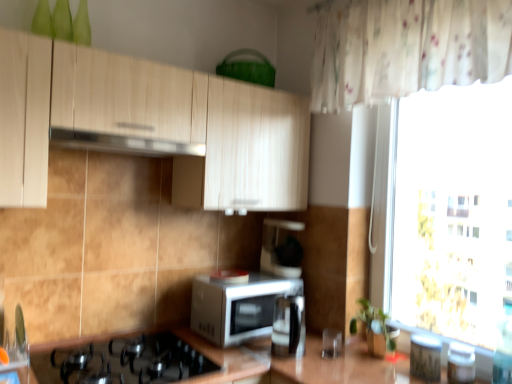
What do you see at coordinates (123, 361) in the screenshot?
I see `black matte gas stove at lower left` at bounding box center [123, 361].

The image size is (512, 384). What do you see at coordinates (451, 210) in the screenshot?
I see `white sheer curtain at right` at bounding box center [451, 210].

You are a GUI agent. You are given a task and a screenshot of the screen. Output one action in this format:
    pyautogui.click(x=<x>, y=<y>)
    Task: Click on the satin silver kettle at center, which is counted as the first appliance, starting from the left
    The height and width of the screenshot is (384, 512).
    Given the screenshot: What is the action you would take?
    pyautogui.click(x=288, y=327)

The width and height of the screenshot is (512, 384). What do you see at coordinates (460, 364) in the screenshot?
I see `metallic silver toaster at right, which is the 1th appliance in right-to-left order` at bounding box center [460, 364].

At what (x,y) coordinates should I click in order to perform the action: click on sleek black coffee machine at center. Please return your answer as a coordinate pair (x, y). This screenshot has height=384, width=512. Looking at the image, I should click on 281,248.

Locate an element on the screen. The height and width of the screenshot is (384, 512). satin silver exhaust hood at upper center is located at coordinates (123, 143).

Describe the element at coordinates (425, 358) in the screenshot. The height and width of the screenshot is (384, 512). I see `metallic silver toaster at lower right, which is the 2th appliance from right to left` at that location.

Locate an element on the screen. This screenshot has height=384, width=512. white glossy microwave at center is located at coordinates (237, 307).

Where is `black matte gas stove at lower left`? The image size is (512, 384). black matte gas stove at lower left is located at coordinates (123, 361).

Between point (448, 351) and point (257, 291), which one is positioned in front?

Positioned in front is point (448, 351).

From the image's perspective, does metallic silver toaster at right, which is counted as the 3th appliance, starting from the left, appear lower than white glossy microwave at center?

Indeed, from the image's perspective, metallic silver toaster at right, which is counted as the 3th appliance, starting from the left, is shown beneath white glossy microwave at center.

Is metallic silver toaster at right, which is counted as the 3th appliance, starting from the left, oriented towards white glossy microwave at center?

No, metallic silver toaster at right, which is counted as the 3th appliance, starting from the left, is not turned towards white glossy microwave at center.

Does metallic silver toaster at right, which is counted as the 3th appliance, starting from the left, have a lesser width compared to white glossy microwave at center?

Yes, metallic silver toaster at right, which is counted as the 3th appliance, starting from the left, is thinner than white glossy microwave at center.

Visually, is metallic silver toaster at right, which is counted as the 3th appliance, starting from the left, positioned to the left or to the right of satin silver exhaust hood at upper center?

metallic silver toaster at right, which is counted as the 3th appliance, starting from the left, is positioned on satin silver exhaust hood at upper center's right side.

Is metallic silver toaster at right, which is counted as the 3th appliance, starting from the left, facing away from satin silver exhaust hood at upper center?

No, metallic silver toaster at right, which is counted as the 3th appliance, starting from the left, is not facing away from satin silver exhaust hood at upper center.

Considering the positions of objects metallic silver toaster at right, which is counted as the 3th appliance, starting from the left, and satin silver exhaust hood at upper center in the image provided, who is behind, metallic silver toaster at right, which is counted as the 3th appliance, starting from the left, or satin silver exhaust hood at upper center?

Positioned behind is metallic silver toaster at right, which is counted as the 3th appliance, starting from the left.

From the image's perspective, is metallic silver toaster at right, which is counted as the 3th appliance, starting from the left, on satin silver exhaust hood at upper center?

Actually, metallic silver toaster at right, which is counted as the 3th appliance, starting from the left, appears below satin silver exhaust hood at upper center in the image.

Based on the photo, from a real-world perspective, is satin silver exhaust hood at upper center physically above white glossy microwave at center?

Correct, in the physical world, satin silver exhaust hood at upper center is higher than white glossy microwave at center.

Between point (189, 146) and point (224, 333), which one is positioned in front?

The point (189, 146) is closer to the camera.

Is satin silver exhaust hood at upper center placed right next to white glossy microwave at center?

There is a gap between satin silver exhaust hood at upper center and white glossy microwave at center.

Is satin silver exhaust hood at upper center wider or thinner than white glossy microwave at center?

In the image, satin silver exhaust hood at upper center appears to be more narrow than white glossy microwave at center.

Is light wood cabinet at upper center in front of white sheer curtain at right?

That is True.

From the image's perspective, is light wood cabinet at upper center above white sheer curtain at right?

Indeed, from the image's perspective, light wood cabinet at upper center is shown above white sheer curtain at right.

Considering the sizes of objects light wood cabinet at upper center and white sheer curtain at right in the image provided, who is wider, light wood cabinet at upper center or white sheer curtain at right?

light wood cabinet at upper center.

From the image's perspective, relative to sleek black coffee machine at center, is white glossy microwave at center above or below?

From the image's perspective, white glossy microwave at center appears below sleek black coffee machine at center.

Is white glossy microwave at center next to sleek black coffee machine at center?

No, white glossy microwave at center is not touching sleek black coffee machine at center.

Looking at their sizes, would you say white glossy microwave at center is wider or thinner than sleek black coffee machine at center?

white glossy microwave at center is wider than sleek black coffee machine at center.

From a real-world perspective, relative to sleek black coffee machine at center, is white glossy microwave at center vertically above or below?

white glossy microwave at center is below sleek black coffee machine at center.

Consider the image. Is white sheer curtain at right thinner than sleek black coffee machine at center?

Correct, the width of white sheer curtain at right is less than that of sleek black coffee machine at center.

Can you confirm if white sheer curtain at right is positioned to the left of sleek black coffee machine at center?

No.

Which point is more forward, [484,212] or [291,245]?

Positioned in front is point [291,245].

Looking at this image, could you measure the distance between satin silver exhaust hood at upper center and black matte gas stove at lower left?

The distance of satin silver exhaust hood at upper center from black matte gas stove at lower left is 33.34 inches.

Looking at this image, does satin silver exhaust hood at upper center turn towards black matte gas stove at lower left?

No.

Can you tell me how much satin silver exhaust hood at upper center and black matte gas stove at lower left differ in facing direction?

The facing directions of satin silver exhaust hood at upper center and black matte gas stove at lower left are 0.738 degrees apart.

Can you confirm if satin silver exhaust hood at upper center is taller than black matte gas stove at lower left?

In fact, satin silver exhaust hood at upper center may be shorter than black matte gas stove at lower left.

Identify the location of the 3rd appliance counting from the right side of the white glossy microwave at center. The height and width of the screenshot is (384, 512). pyautogui.click(x=460, y=364).

Where is `exhaust hood above the metallic silver toaster at right, which is counted as the 3th appliance, starting from the left (from a real-world perspective)`? The image size is (512, 384). exhaust hood above the metallic silver toaster at right, which is counted as the 3th appliance, starting from the left (from a real-world perspective) is located at coordinates (123, 143).

Looking at the image, which one is located closer to metallic silver toaster at right, which is the 1th appliance in right-to-left order, black matte gas stove at lower left or sleek black coffee machine at center?

sleek black coffee machine at center is positioned closer to the anchor metallic silver toaster at right, which is the 1th appliance in right-to-left order.

Based on their spatial positions, is sleek black coffee machine at center or black matte gas stove at lower left further from satin silver exhaust hood at upper center?

Among the two, black matte gas stove at lower left is located further to satin silver exhaust hood at upper center.

When comparing their distances from sleek black coffee machine at center, does satin silver exhaust hood at upper center or metallic silver toaster at right, which is the 1th appliance in right-to-left order, seem closer?

satin silver exhaust hood at upper center is positioned closer to the anchor sleek black coffee machine at center.

Looking at the image, which one is located further to light wood cabinet at upper center, satin silver exhaust hood at upper center or white sheer curtain at right?

white sheer curtain at right is further to light wood cabinet at upper center.

Which object lies further to the anchor point white sheer curtain at right, satin silver exhaust hood at upper center or black matte gas stove at lower left?

satin silver exhaust hood at upper center.

From the image, which object appears to be nearer to satin silver kettle at center, which is the 3th appliance from right to left, metallic silver toaster at lower right, which appears as the second appliance when viewed from the left, or white sheer curtain at right?

metallic silver toaster at lower right, which appears as the second appliance when viewed from the left, lies closer to satin silver kettle at center, which is the 3th appliance from right to left, than the other object.

Estimate the real-world distances between objects in this image. Which object is further from sleek black coffee machine at center, metallic silver toaster at lower right, which appears as the second appliance when viewed from the left, or metallic silver toaster at right, which is the 1th appliance in right-to-left order?

The object further to sleek black coffee machine at center is metallic silver toaster at right, which is the 1th appliance in right-to-left order.

Considering their positions, is black matte gas stove at lower left positioned closer to white glossy microwave at center than light wood cabinet at upper center?

black matte gas stove at lower left.

The width and height of the screenshot is (512, 384). In order to click on microwave oven located between light wood cabinet at upper center and metallic silver toaster at lower right, which appears as the second appliance when viewed from the left, in the left-right direction in this screenshot , I will do [237, 307].

Find the location of a particular element. The image size is (512, 384). coffee machine between light wood cabinet at upper center and metallic silver toaster at right, which is counted as the 3th appliance, starting from the left, in the horizontal direction is located at coordinates (281, 248).

Find the location of a particular element. This screenshot has height=384, width=512. cabinetry between black matte gas stove at lower left and metallic silver toaster at lower right, which is the 2th appliance from right to left is located at coordinates (149, 125).

Locate an element on the screen. window screen located between sleek black coffee machine at center and metallic silver toaster at right, which is counted as the 3th appliance, starting from the left, in the left-right direction is located at coordinates (451, 210).